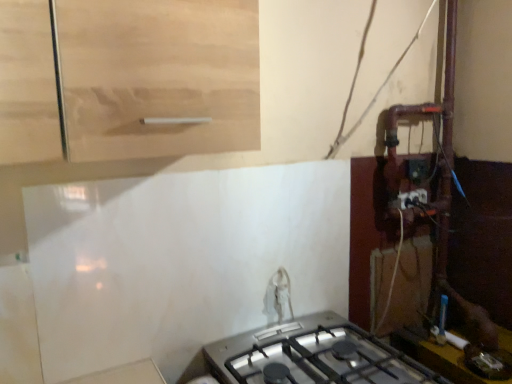
At what (x,y) coordinates should I click in order to perform the action: click on satin silver gas stove at lower center. Please return your answer as a coordinate pair (x, y). The image size is (512, 384). Looking at the image, I should click on (314, 355).

Image resolution: width=512 pixels, height=384 pixels. What do you see at coordinates (314, 355) in the screenshot?
I see `satin silver gas stove at lower center` at bounding box center [314, 355].

Where is `satin silver gas stove at lower center`? satin silver gas stove at lower center is located at coordinates tap(314, 355).